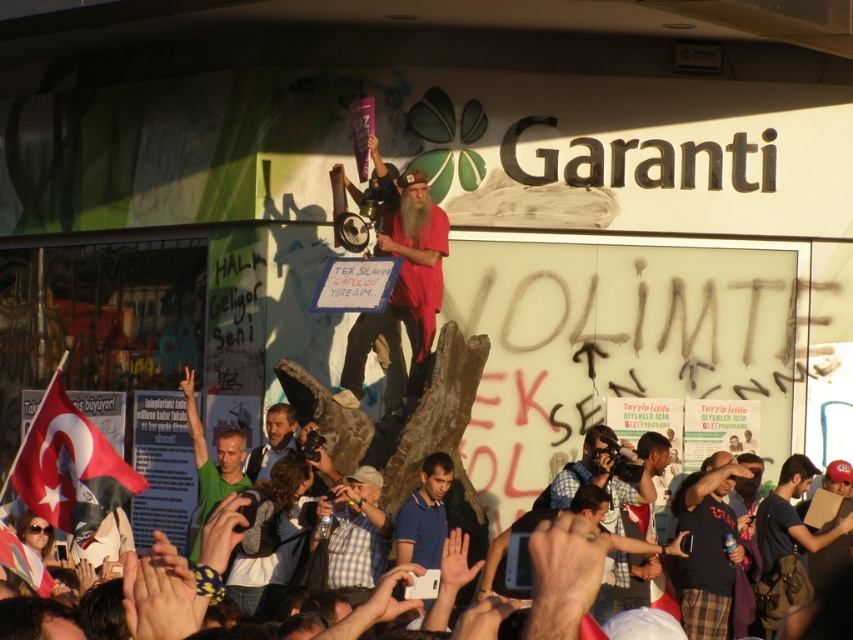
You are a photographer trying to capture a photo of the dark blue shirt at center and the green matte shirt at lower left in the same frame. The camera you are using has a maximum focus range of 30 feet. Can you fit both subjects into the frame without moving your position?

The distance between the dark blue shirt at center and the green matte shirt at lower left is 28.09 feet, which is within the camera maximum focus range of 30 feet. Therefore, you can fit both subjects into the frame without moving your position.

You are a photographer at the protest scene. You want to capture a photo that includes both the white fabric flag at lower left and the green matte shirt at lower left. Which object should you position closer to the camera to ensure both are visible in the frame?

To ensure both the white fabric flag at lower left and the green matte shirt at lower left are visible in the frame, you should position the white fabric flag at lower left closer to the camera since it is already in front of the green matte shirt at lower left.

You are a photographer at the protest scene. You want to take a photo that includes both the checkered fabric shirt at center and the blue cotton shirt at center. Which shirt should you position to the left side of your camera frame to ensure both are visible?

You should position the checkered fabric shirt at center to the left side of your camera frame because it is already to the left of the blue cotton shirt at center in the scene.